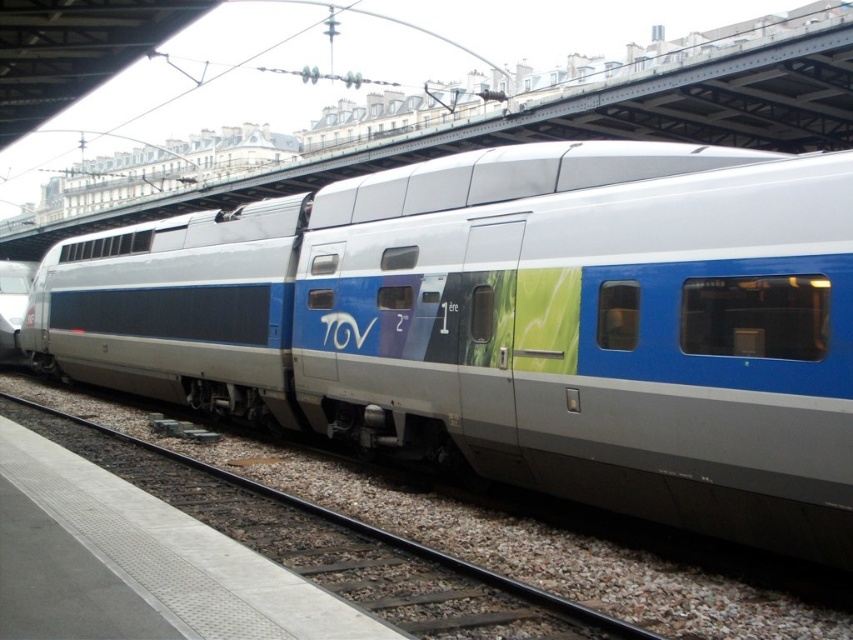
Which of these two, silver metallic train at center or metal/smooth track at lower center, stands shorter?

metal/smooth track at lower center

Which is above, silver metallic train at center or metal/smooth track at lower center?

silver metallic train at center is above.

Who is more forward, (752, 480) or (247, 499)?

Point (752, 480) is in front.

Find the location of a particular element. silver metallic train at center is located at coordinates (514, 324).